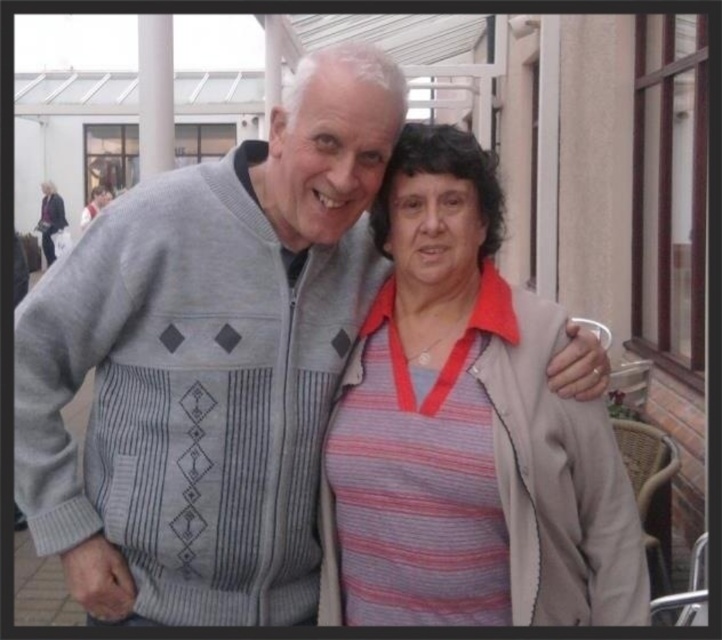
You are a fashion designer observing two people in an image. You notice a striped fabric shirt at center and a striped fabric sweater at center. Which clothing item is positioned lower on the body?

The striped fabric shirt at center is positioned lower on the body because it is below the striped fabric sweater at center.